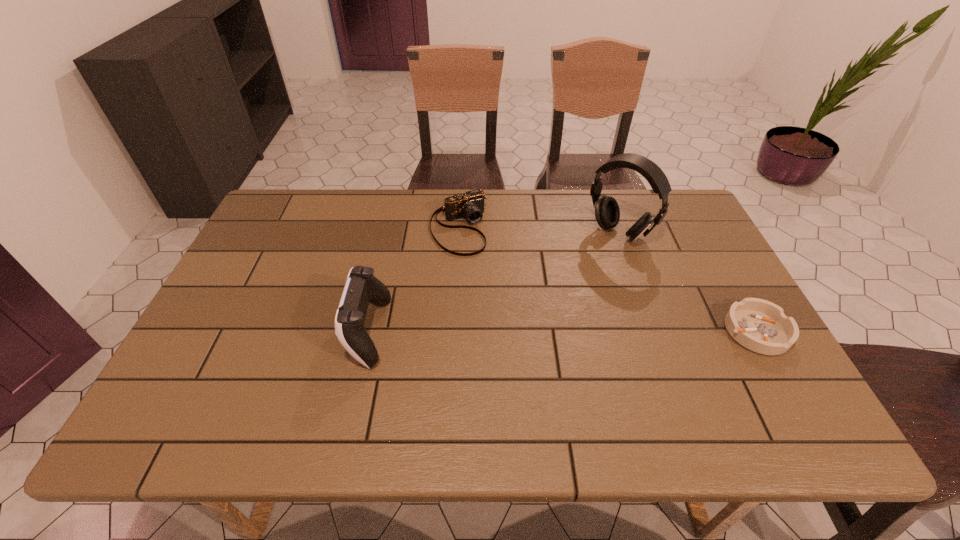
In order to click on free space on the desktop that is between the control and the ashtray and is positioned on the ear cups of the earphone in this screenshot , I will do `click(517, 332)`.

Find the location of a particular element. The width and height of the screenshot is (960, 540). vacant spot on the desktop that is between the third shortest object and the ashtray and is positioned on the front-facing side of the camera is located at coordinates (518, 332).